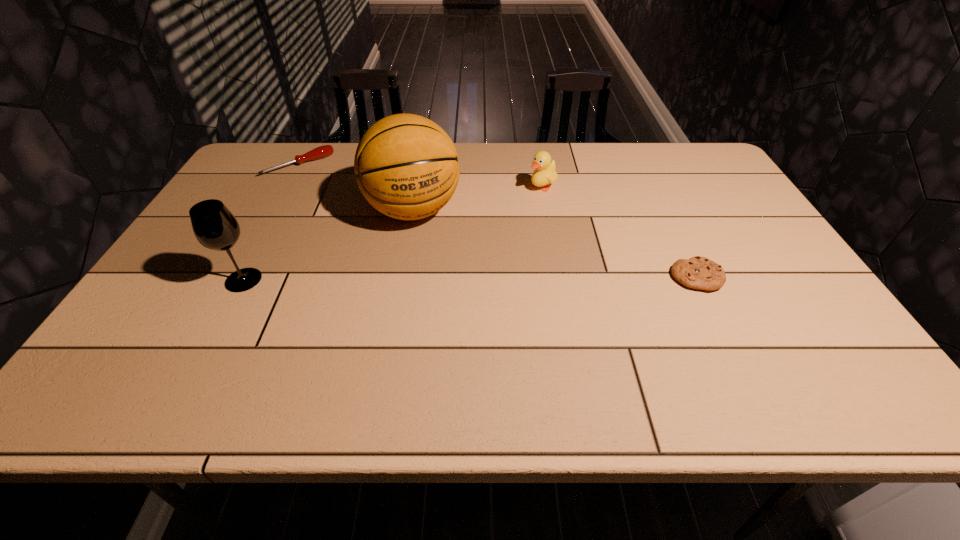
Locate an element on the screen. The height and width of the screenshot is (540, 960). free space on the desktop that is between the wineglass and the shortest object and is positioned on the surface of the basketball near the brand logo is located at coordinates (436, 279).

Find the location of a particular element. vacant space on the desktop that is between the second tallest object and the rightmost object and is positioned at the tip of the screwdriver is located at coordinates (x=402, y=279).

You are a GUI agent. You are given a task and a screenshot of the screen. Output one action in this format:
    pyautogui.click(x=<x>, y=<y>)
    Task: Click on the vacant space on the desktop that is between the fourth shortest object and the cookie and is positioned on the front-facing side of the second object from right to left
    This screenshot has width=960, height=540.
    Given the screenshot: What is the action you would take?
    pyautogui.click(x=403, y=279)